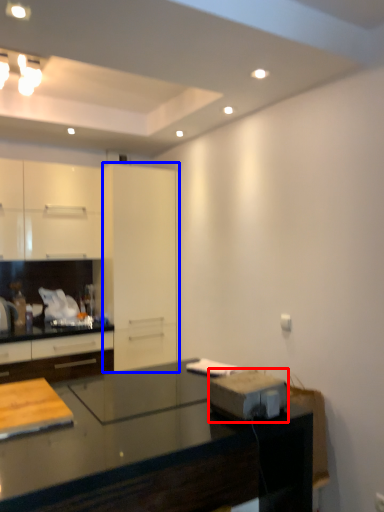
Question: Which point is closer to the camera, appliance (highlighted by a red box) or glass door (highlighted by a blue box)?

Choices:
 (A) appliance
 (B) glass door

Answer: (A)